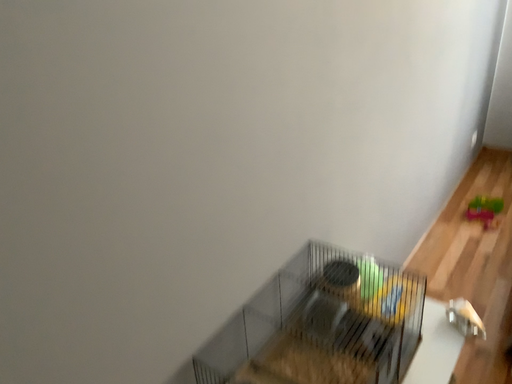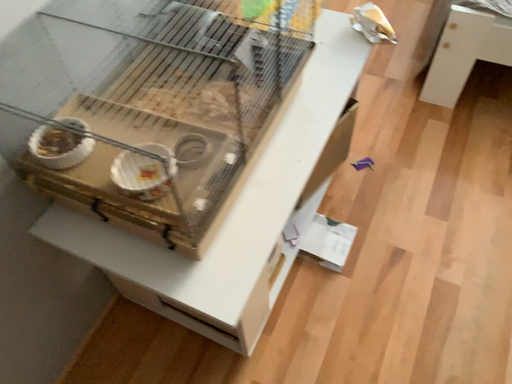
Question: Which way did the camera rotate in the video?

Choices:
 (A) rotated upward
 (B) rotated downward

Answer: (B)